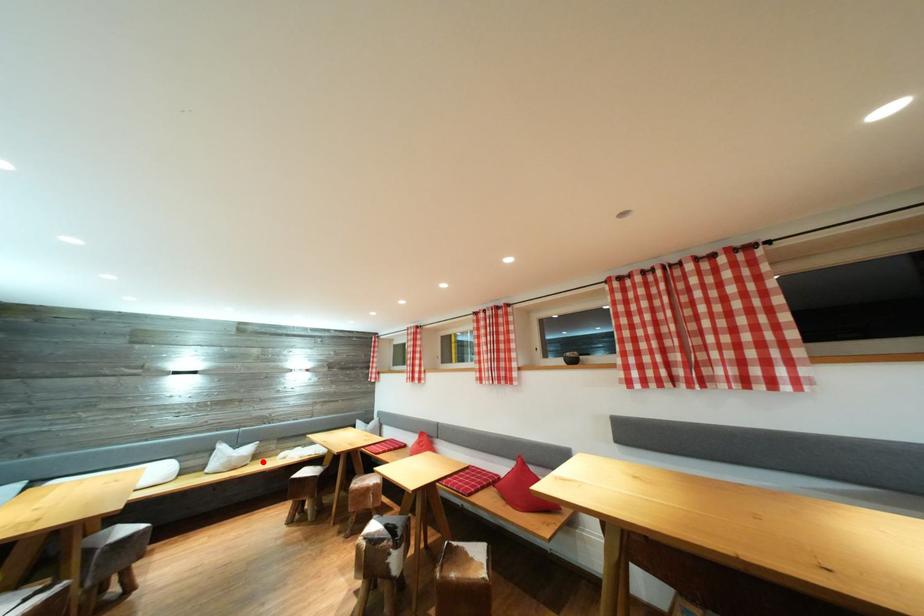
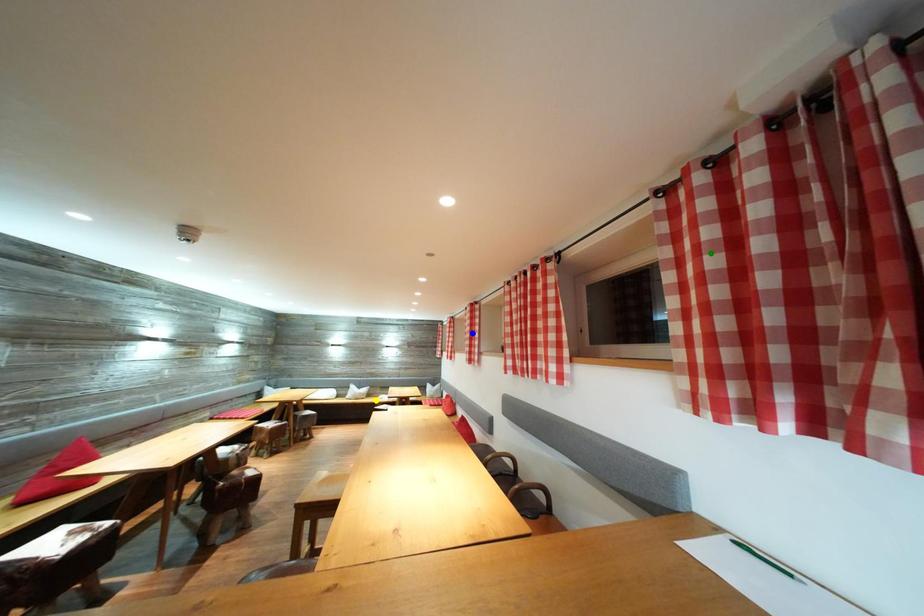
Question: I am providing you with two images of the same scene from different viewpoints. A red point is marked on the first image. You are given multiple points on the second image. Which spot in image 2 lines up with the point in image 1?

Choices:
 (A) blue point
 (B) green point
 (C) yellow point

Answer: (C)